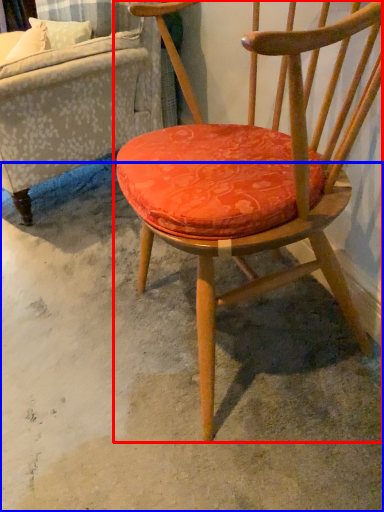
Question: Which point is further to the camera, chair (highlighted by a red box) or concrete (highlighted by a blue box)?

Choices:
 (A) chair
 (B) concrete

Answer: (B)